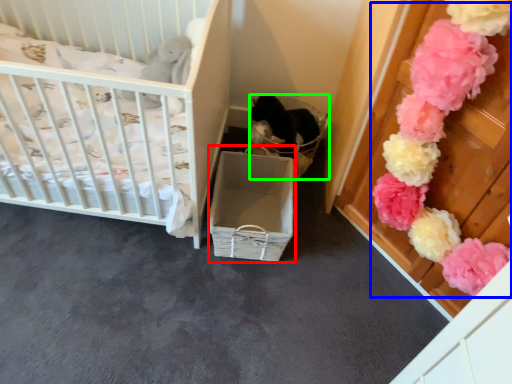
Question: Which is farther away from crate (highlighted by a red box)? flower (highlighted by a blue box) or basket (highlighted by a green box)?

Choices:
 (A) flower
 (B) basket

Answer: (A)